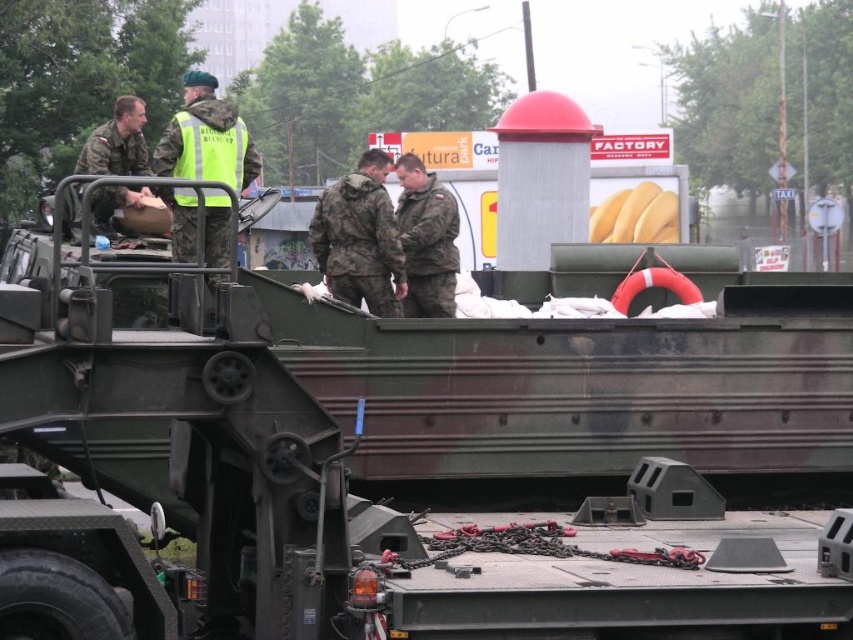
Does camouflage uniform at center have a smaller size compared to matte green uniform at left?

Result: No.

Who is more distant from viewer, (431, 300) or (140, 160)?

The point (140, 160) is behind.

This screenshot has width=853, height=640. I want to click on camouflage uniform at center, so click(426, 240).

Does camouflage fabric uniform at center appear under camouflage uniform at center?

Yes.

Can you confirm if camouflage fabric uniform at center is taller than camouflage uniform at center?

Incorrect, camouflage fabric uniform at center's height is not larger of camouflage uniform at center's.

Is point (354, 269) closer to camera compared to point (451, 314)?

That is True.

You are a GUI agent. You are given a task and a screenshot of the screen. Output one action in this format:
    pyautogui.click(x=<x>, y=<y>)
    Task: Click on the camouflage fabric uniform at center
    The image size is (853, 640).
    Given the screenshot: What is the action you would take?
    pyautogui.click(x=360, y=237)

Which is in front, point (189, 118) or point (322, 195)?

Point (189, 118)

Between green reflective vest at upper center and camouflage fabric uniform at center, which one is positioned higher?

green reflective vest at upper center

This screenshot has height=640, width=853. I want to click on green reflective vest at upper center, so click(206, 138).